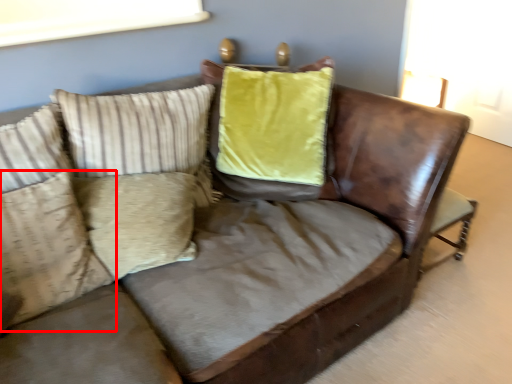
Question: From the image's perspective, where is pillow (annotated by the red box) located relative to pillow?

Choices:
 (A) below
 (B) above

Answer: (A)